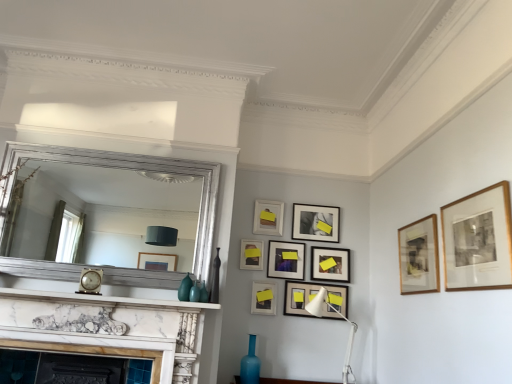
Question: Is matte black picture frame at lower center, which is the fourth picture frame in front-to-back order, further to the viewer compared to wooden framed artwork at upper right, which is the second picture frame from front to back?

Choices:
 (A) yes
 (B) no

Answer: (A)

Question: Does matte black picture frame at lower center, arranged as the sixth picture frame when viewed from the back, have a lesser width compared to wooden framed artwork at upper right, positioned as the eighth picture frame in back-to-front order?

Choices:
 (A) no
 (B) yes

Answer: (B)

Question: From the image's perspective, is matte black picture frame at lower center, arranged as the sixth picture frame when viewed from the back, above wooden framed artwork at upper right, positioned as the eighth picture frame in back-to-front order?

Choices:
 (A) yes
 (B) no

Answer: (B)

Question: Does matte black picture frame at lower center, which is the fourth picture frame in front-to-back order, have a smaller size compared to wooden framed artwork at upper right, which is the second picture frame from front to back?

Choices:
 (A) no
 (B) yes

Answer: (B)

Question: Can you confirm if matte black picture frame at lower center, which is the fourth picture frame in front-to-back order, is wider than wooden framed artwork at upper right, positioned as the eighth picture frame in back-to-front order?

Choices:
 (A) yes
 (B) no

Answer: (B)

Question: Would you say gold-framed print at upper right, acting as the 9th picture frame starting from the back, is to the left or to the right of silver metallic mirror at upper center in the picture?

Choices:
 (A) right
 (B) left

Answer: (A)

Question: Do you think gold-framed print at upper right, marked as the 1th picture frame in a front-to-back arrangement, is within silver metallic mirror at upper center, or outside of it?

Choices:
 (A) inside
 (B) outside

Answer: (B)

Question: Is gold-framed print at upper right, marked as the 1th picture frame in a front-to-back arrangement, bigger or smaller than silver metallic mirror at upper center?

Choices:
 (A) big
 (B) small

Answer: (B)

Question: From a real-world perspective, is gold-framed print at upper right, marked as the 1th picture frame in a front-to-back arrangement, above or below silver metallic mirror at upper center?

Choices:
 (A) above
 (B) below

Answer: (B)

Question: From a real-world perspective, is wooden framed artwork at upper right, positioned as the eighth picture frame in back-to-front order, positioned above or below matte black picture frame at center, the 6th picture frame in the front-to-back sequence?

Choices:
 (A) above
 (B) below

Answer: (B)

Question: Considering the positions of wooden framed artwork at upper right, positioned as the eighth picture frame in back-to-front order, and matte black picture frame at center, the 6th picture frame in the front-to-back sequence, in the image, is wooden framed artwork at upper right, positioned as the eighth picture frame in back-to-front order, wider or thinner than matte black picture frame at center, the 6th picture frame in the front-to-back sequence,?

Choices:
 (A) wide
 (B) thin

Answer: (A)

Question: Considering the positions of wooden framed artwork at upper right, positioned as the eighth picture frame in back-to-front order, and matte black picture frame at center, the fourth picture frame from the back, in the image, is wooden framed artwork at upper right, positioned as the eighth picture frame in back-to-front order, bigger or smaller than matte black picture frame at center, the fourth picture frame from the back,?

Choices:
 (A) big
 (B) small

Answer: (A)

Question: From the image's perspective, relative to matte black picture frame at center, the fourth picture frame from the back, is wooden framed artwork at upper right, positioned as the eighth picture frame in back-to-front order, above or below?

Choices:
 (A) above
 (B) below

Answer: (A)

Question: Would you say marble mantel at center is inside or outside matte black picture frame at center, the 3th picture frame viewed from the front?

Choices:
 (A) inside
 (B) outside

Answer: (B)

Question: Considering their positions, is marble mantel at center located in front of or behind matte black picture frame at center, the 3th picture frame viewed from the front?

Choices:
 (A) behind
 (B) front

Answer: (B)